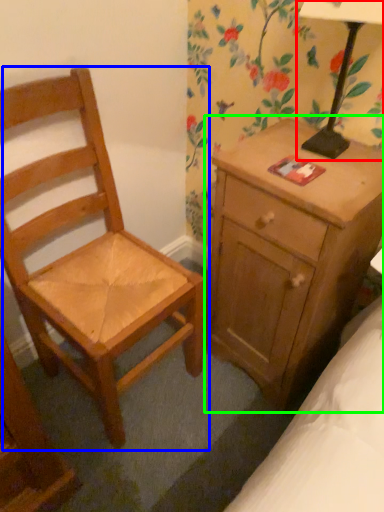
Question: Based on their relative distances, which object is farther from table lamp (highlighted by a red box)? Choose from chair (highlighted by a blue box) and nightstand (highlighted by a green box).

Choices:
 (A) chair
 (B) nightstand

Answer: (A)